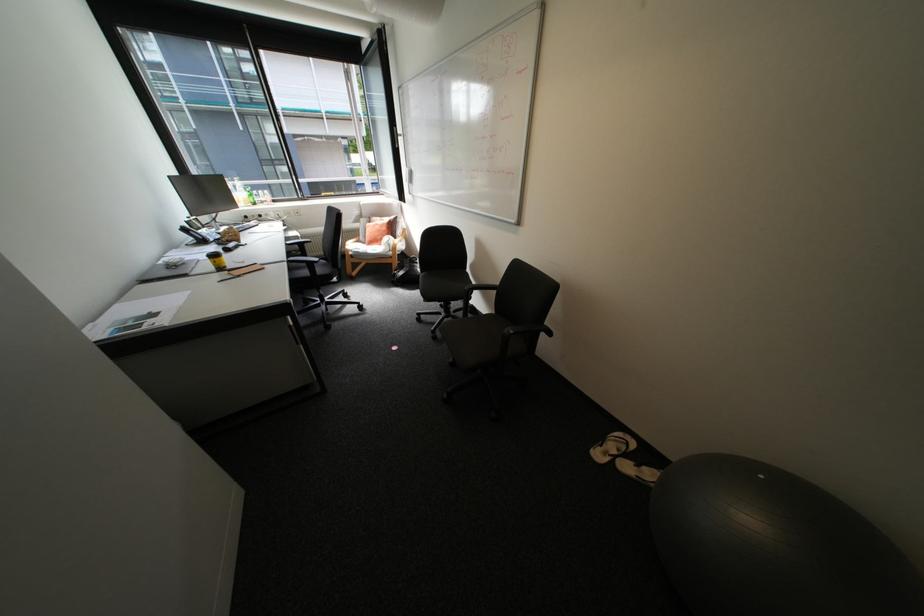
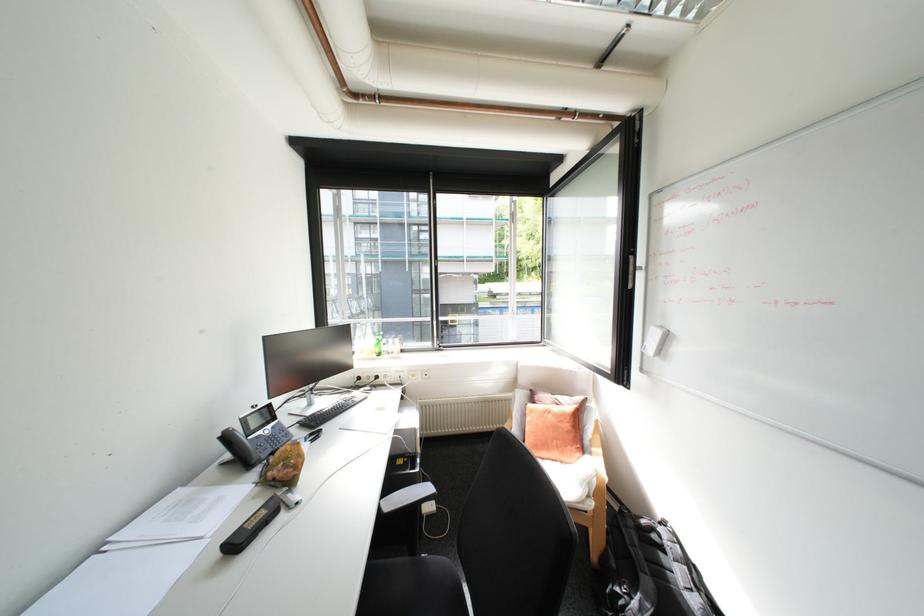
In the second image, find the point that corresponds to [256,204] in the first image.

(379, 354)